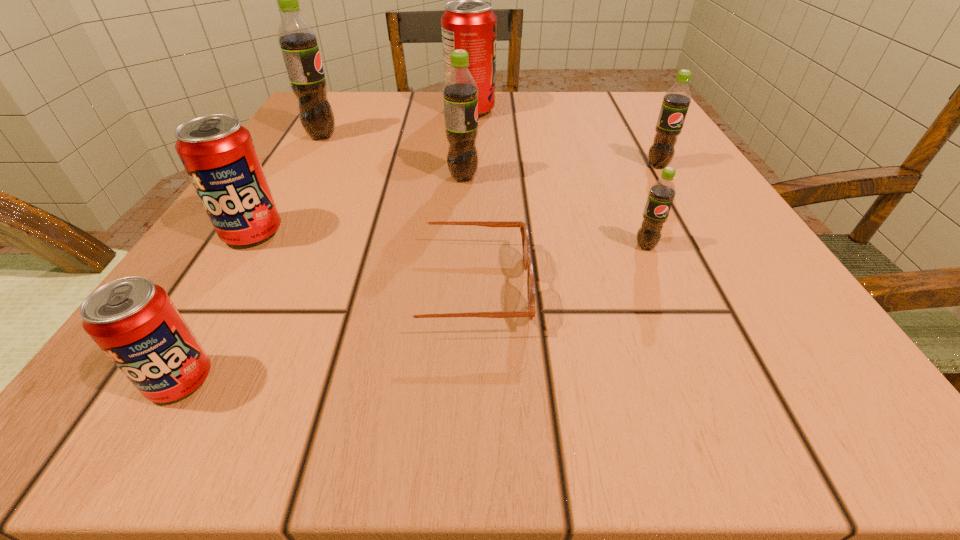
This screenshot has height=540, width=960. Identify the location of free spot at the near right corner of the desktop. (861, 391).

You are a GUI agent. You are given a task and a screenshot of the screen. Output one action in this format:
    pyautogui.click(x=<x>, y=<y>)
    Task: Click on the vacant region between the second farthest red soda can and the seventh nearest object
    The width and height of the screenshot is (960, 540).
    Given the screenshot: What is the action you would take?
    pyautogui.click(x=287, y=184)

This screenshot has width=960, height=540. I want to click on free space between the nearest soda can and the second smallest red soda can, so click(217, 306).

I want to click on free space that is in between the second smallest red soda can and the sunglasses, so 356,260.

Where is `empty space that is in between the third green soda from right to left and the sunglasses`? empty space that is in between the third green soda from right to left and the sunglasses is located at coordinates (462, 232).

At what (x,y) coordinates should I click in order to perform the action: click on free space between the rightmost red soda can and the sunglasses. Please return your answer as a coordinate pair (x, y). This screenshot has height=540, width=960. Looking at the image, I should click on (466, 199).

Where is `free space between the brown sunglasses and the farthest red soda can`? free space between the brown sunglasses and the farthest red soda can is located at coordinates click(466, 199).

Where is `free space between the smallest red soda can and the brown sunglasses`? Image resolution: width=960 pixels, height=540 pixels. free space between the smallest red soda can and the brown sunglasses is located at coordinates (321, 333).

Locate an element on the screen. free space that is in between the rightmost soda can and the biggest red soda can is located at coordinates (564, 138).

You are a GUI agent. You are given a task and a screenshot of the screen. Output one action in this format:
    pyautogui.click(x=<x>, y=<y>)
    Task: Click on the free point between the smallest red soda can and the sixth soda can from left to right
    
    Given the screenshot: What is the action you would take?
    pyautogui.click(x=413, y=313)